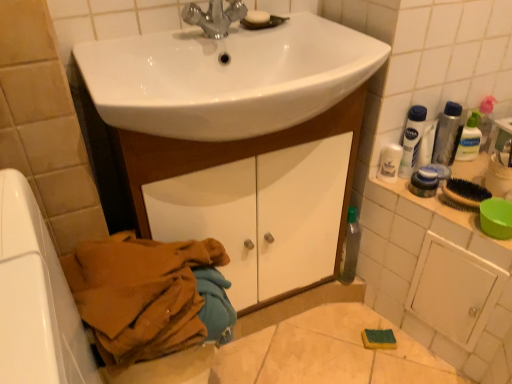
Image resolution: width=512 pixels, height=384 pixels. I want to click on free spot in front of white plastic container at upper right, which is counted as the first toiletry, starting from the left, so click(x=444, y=217).